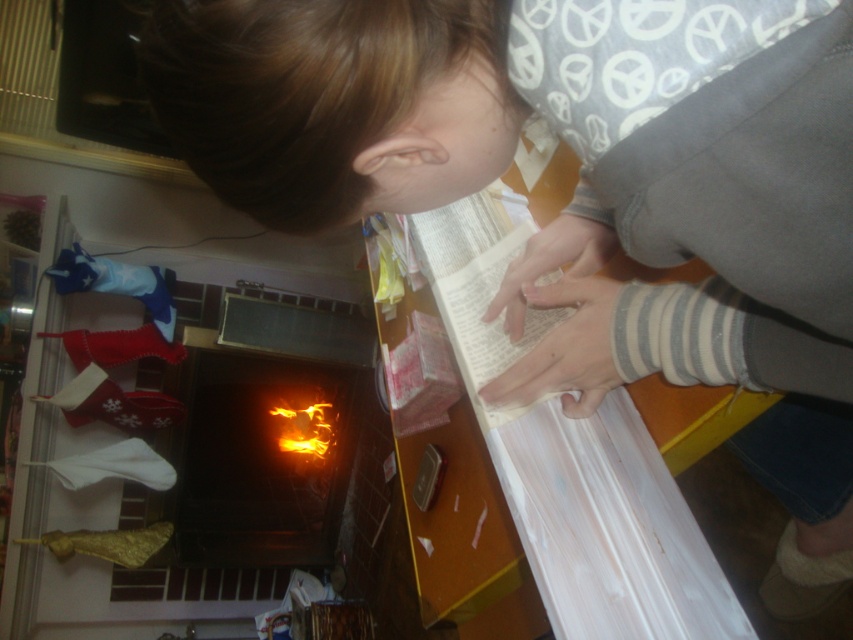
Question: Does brick fireplace at lower left appear on the right side of orange glowing fire at center?

Choices:
 (A) yes
 (B) no

Answer: (B)

Question: From the image, what is the correct spatial relationship of brick fireplace at lower left in relation to orange glowing fire at center?

Choices:
 (A) right
 (B) left

Answer: (B)

Question: Is brick fireplace at lower left positioned in front of orange glowing fire at center?

Choices:
 (A) yes
 (B) no

Answer: (A)